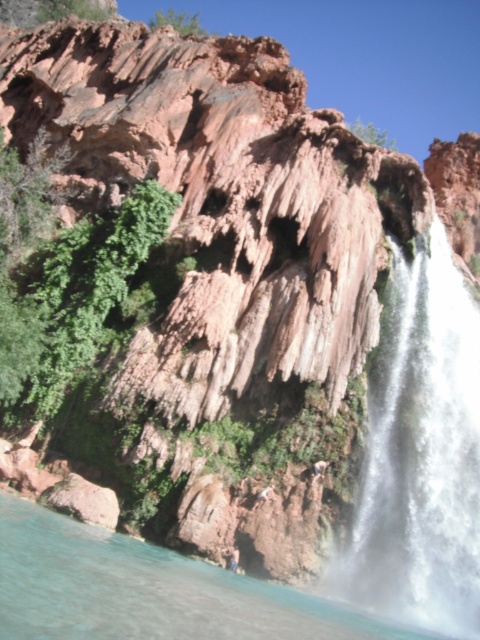
Who is shorter, clear blue water at lower left or brown textured rock at center?

With less height is brown textured rock at center.

Between clear blue water at lower left and brown textured rock at center, which one has more height?

clear blue water at lower left is taller.

The height and width of the screenshot is (640, 480). What are the coordinates of `clear blue water at lower left` in the screenshot? It's located at (146, 589).

This screenshot has height=640, width=480. I want to click on clear blue water at lower left, so click(146, 589).

Between white frothy water at right and clear blue water at lower left, which one appears on the right side from the viewer's perspective?

From the viewer's perspective, white frothy water at right appears more on the right side.

Who is more forward, (416, 513) or (256, 586)?

Point (256, 586) is more forward.

Between point (434, 621) and point (183, 592), which one is positioned in front?

Point (183, 592)

Locate an element on the screen. This screenshot has width=480, height=640. white frothy water at right is located at coordinates (420, 452).

Is white frothy water at right to the left of brown textured rock at center from the viewer's perspective?

Result: In fact, white frothy water at right is to the right of brown textured rock at center.

Is white frothy water at right thinner than brown textured rock at center?

In fact, white frothy water at right might be wider than brown textured rock at center.

I want to click on white frothy water at right, so click(420, 452).